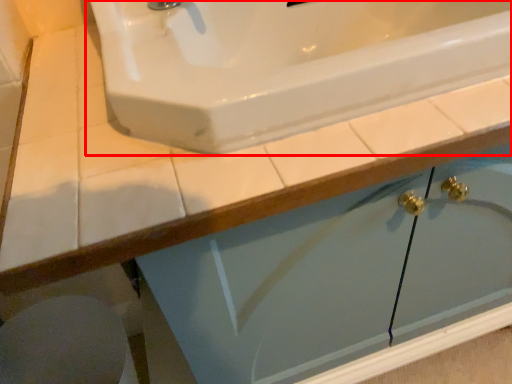
Question: From the image's perspective, where is sink (annotated by the red box) located relative to porcelain?

Choices:
 (A) above
 (B) below

Answer: (A)